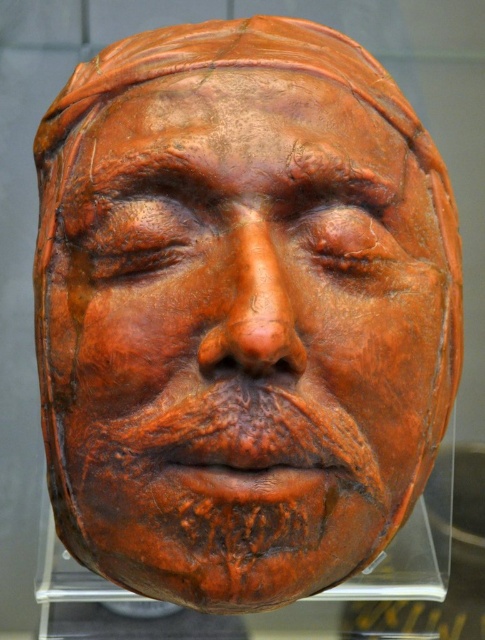
Does matte clay mask at center have a lesser height compared to transparent plastic mask at center?

Incorrect, matte clay mask at center's height does not fall short of transparent plastic mask at center's.

Does matte clay mask at center have a lesser width compared to transparent plastic mask at center?

Yes, matte clay mask at center is thinner than transparent plastic mask at center.

Is point (173, 364) farther from camera compared to point (108, 582)?

No.

Find the location of a particular element. This screenshot has height=640, width=485. matte clay mask at center is located at coordinates (242, 337).